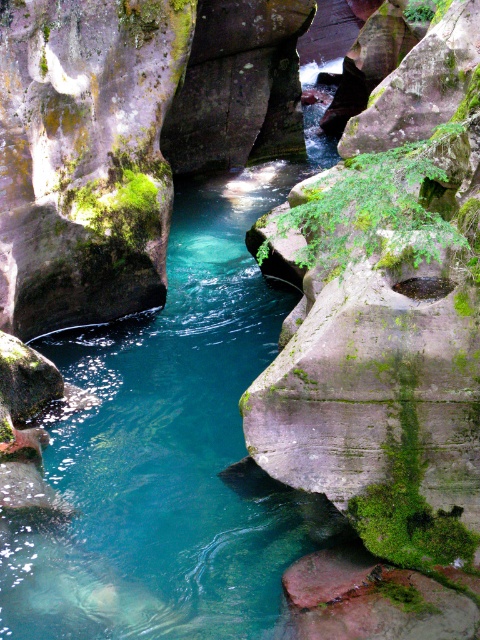
Question: Among these points, which one is nearest to the camera?

Choices:
 (A) (112, 140)
 (B) (211, 227)

Answer: (A)

Question: Can you confirm if clear water at center is smaller than green mossy rock at left?

Choices:
 (A) no
 (B) yes

Answer: (A)

Question: Is clear water at center to the right of green mossy rock at left from the viewer's perspective?

Choices:
 (A) yes
 (B) no

Answer: (A)

Question: Which of the following is the closest to the observer?

Choices:
 (A) clear water at center
 (B) green mossy rock at left

Answer: (A)

Question: Can you confirm if clear water at center is positioned to the left of green mossy rock at left?

Choices:
 (A) yes
 (B) no

Answer: (B)